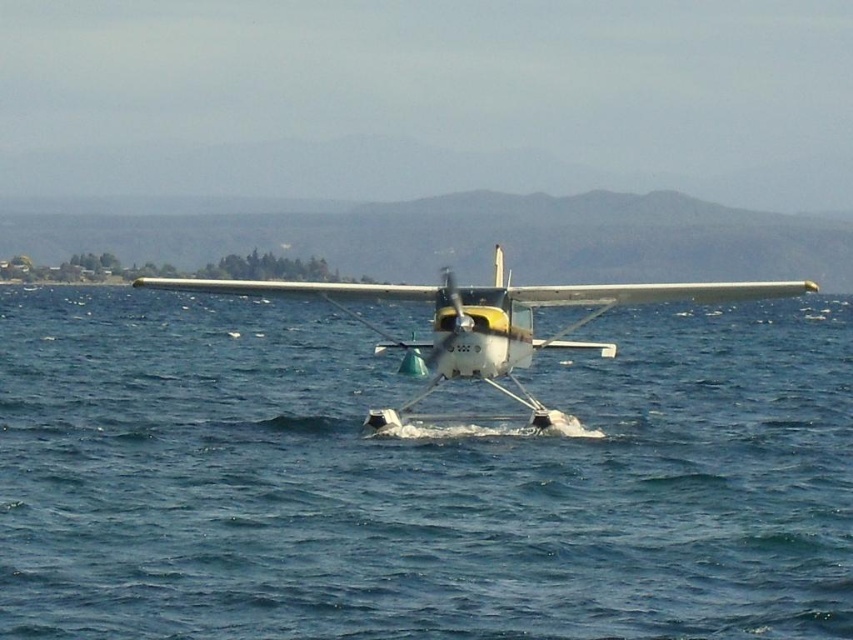
Question: Among these points, which one is farthest from the camera?

Choices:
 (A) (450, 321)
 (B) (252, 371)

Answer: (B)

Question: Which of the following is the closest to the observer?

Choices:
 (A) (496, 300)
 (B) (189, 352)

Answer: (A)

Question: Does blue water at center appear under white matte seaplane at center?

Choices:
 (A) no
 (B) yes

Answer: (B)

Question: Which point is closer to the camera?

Choices:
 (A) (751, 374)
 (B) (552, 420)

Answer: (B)

Question: Is blue water at center below white matte seaplane at center?

Choices:
 (A) yes
 (B) no

Answer: (A)

Question: Can you confirm if blue water at center is positioned to the left of white matte seaplane at center?

Choices:
 (A) no
 (B) yes

Answer: (B)